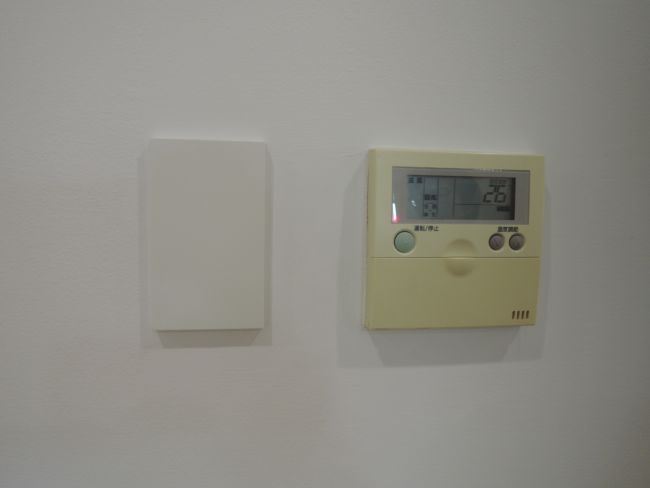
Where is `white box on the wall`? This screenshot has width=650, height=488. white box on the wall is located at coordinates (199, 229).